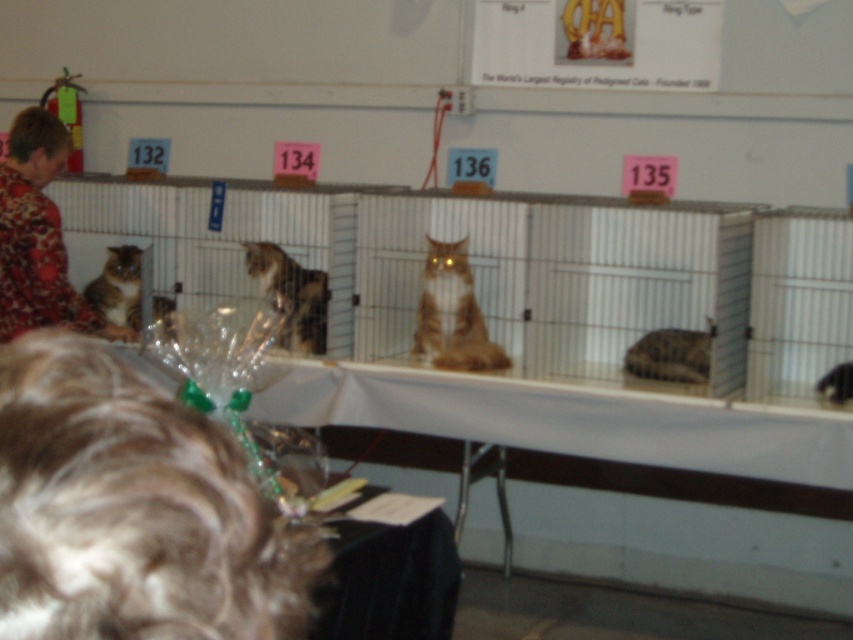
Can you confirm if fuzzy brown hair at lower left is positioned above white plastic table at center?

Correct, fuzzy brown hair at lower left is located above white plastic table at center.

From the picture: Is fuzzy brown hair at lower left closer to camera compared to white plastic table at center?

Yes, it is in front of white plastic table at center.

The width and height of the screenshot is (853, 640). Find the location of `fuzzy brown hair at lower left`. fuzzy brown hair at lower left is located at coordinates (132, 509).

Locate an element on the screen. fuzzy brown hair at lower left is located at coordinates (132, 509).

Is white plastic table at center further to the viewer compared to orange fur cat at center?

Yes.

Which is above, white plastic table at center or orange fur cat at center?

Positioned higher is orange fur cat at center.

The height and width of the screenshot is (640, 853). In order to click on white plastic table at center in this screenshot , I will do `click(680, 531)`.

Which is more to the left, fuzzy brown hair at lower left or calico fur cat at center?

calico fur cat at center

Which is more to the right, fuzzy brown hair at lower left or calico fur cat at center?

fuzzy brown hair at lower left

This screenshot has width=853, height=640. In order to click on fuzzy brown hair at lower left in this screenshot , I will do `click(132, 509)`.